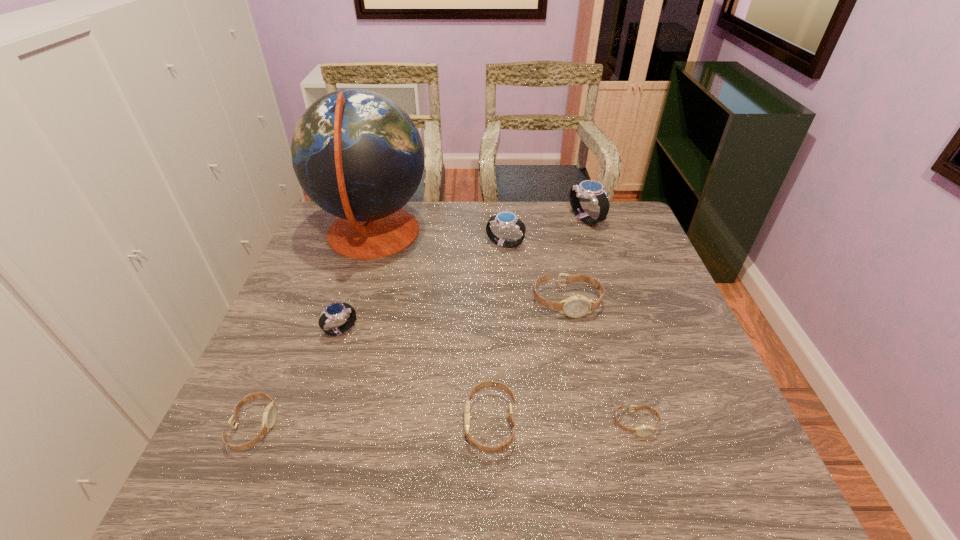
You are a GUI agent. You are given a task and a screenshot of the screen. Output one action in this format:
    pyautogui.click(x=<x>, y=<y>)
    Task: Click on the globe
    This screenshot has width=960, height=540.
    Given the screenshot: What is the action you would take?
    pyautogui.click(x=357, y=154)

Locate an element on the screen. The image size is (960, 540). the rightmost silver watch is located at coordinates (589, 189).

What are the coordinates of `the farthest silver watch` in the screenshot? It's located at (589, 189).

You are a GUI agent. You are given a task and a screenshot of the screen. Output one action in this format:
    pyautogui.click(x=<x>, y=<y>)
    Task: Click on the second farthest watch
    
    Given the screenshot: What is the action you would take?
    pyautogui.click(x=505, y=220)

Where is `the second smallest silver watch`? the second smallest silver watch is located at coordinates (505, 220).

Where is `the third farthest watch`? This screenshot has width=960, height=540. the third farthest watch is located at coordinates (576, 306).

You are a GUI agent. You are given a task and a screenshot of the screen. Output one action in this format:
    pyautogui.click(x=<x>, y=<y>)
    Task: Click on the fourth farthest object
    
    Given the screenshot: What is the action you would take?
    pyautogui.click(x=576, y=306)

Image resolution: width=960 pixels, height=540 pixels. Identify the location of the fourth nearest object. (335, 311).

What are the coordinates of `the leftmost silver watch` in the screenshot? It's located at (335, 311).

This screenshot has height=540, width=960. I want to click on the third shortest object, so click(506, 444).